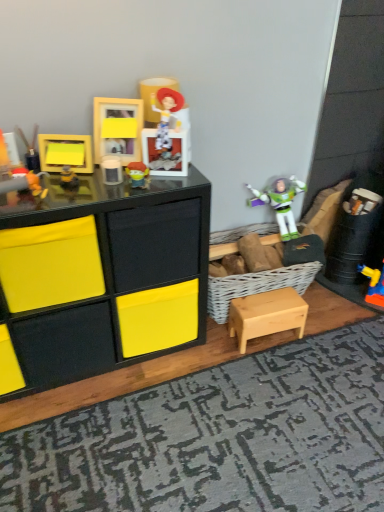
Where is `vacant area that lies between yellow matte frame at upper left, the fourth toy when ordered from right to left, and matte yellow frame at upper left, which appears as the fourth toy when viewed from the left`? The image size is (384, 512). vacant area that lies between yellow matte frame at upper left, the fourth toy when ordered from right to left, and matte yellow frame at upper left, which appears as the fourth toy when viewed from the left is located at coordinates 70,178.